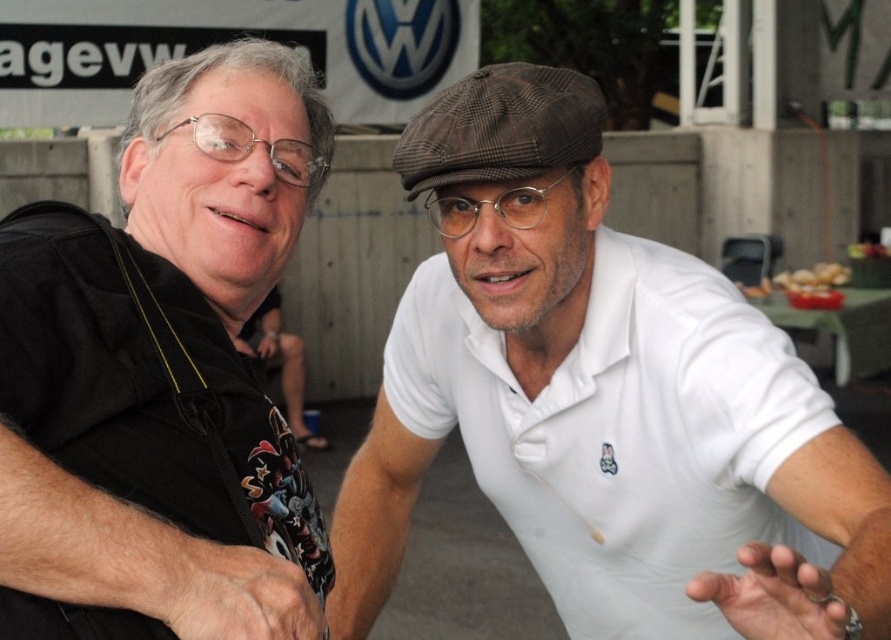
Does white cotton shirt at center appear on the right side of brown crumbly bread at right?

No, white cotton shirt at center is not to the right of brown crumbly bread at right.

Looking at this image, who is higher up, white cotton shirt at center or brown crumbly bread at right?

brown crumbly bread at right is higher up.

Which is in front, point (726, 625) or point (832, 288)?

Point (726, 625) is more forward.

Identify the location of white cotton shirt at center. The image size is (891, 640). (601, 397).

Can you confirm if black matte shirt at left is bigger than brown crumbly bread at right?

No, black matte shirt at left is not bigger than brown crumbly bread at right.

Locate an element on the screen. The height and width of the screenshot is (640, 891). black matte shirt at left is located at coordinates (162, 372).

Can you confirm if white cotton shirt at center is wider than black matte shirt at left?

Correct, the width of white cotton shirt at center exceeds that of black matte shirt at left.

Can you confirm if white cotton shirt at center is bigger than black matte shirt at left?

Indeed, white cotton shirt at center has a larger size compared to black matte shirt at left.

Describe the element at coordinates (601, 397) in the screenshot. Image resolution: width=891 pixels, height=640 pixels. I see `white cotton shirt at center` at that location.

Find the location of a particular element. This screenshot has height=640, width=891. white cotton shirt at center is located at coordinates (601, 397).